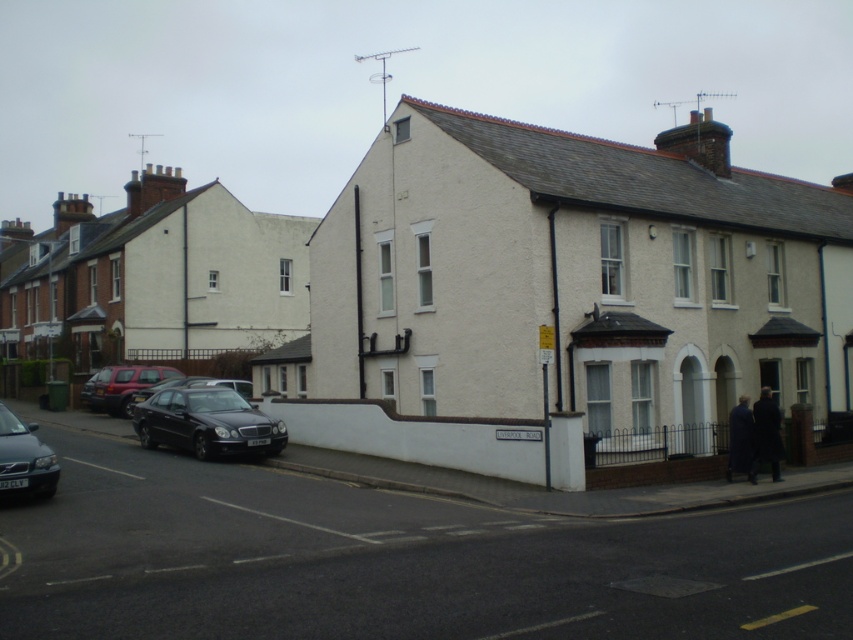
Does matte black car at lower left have a greater height compared to shiny black sedan at center-left?

Yes.

Is matte black car at lower left bigger than shiny black sedan at center-left?

Indeed, matte black car at lower left has a larger size compared to shiny black sedan at center-left.

Which is in front, point (45, 468) or point (183, 380)?

Point (45, 468) is more forward.

Find the location of `matte black car at lower left`. matte black car at lower left is located at coordinates (24, 458).

Does shiny black sedan at lower left have a lesser height compared to matte red car at lower left?

Yes, shiny black sedan at lower left is shorter than matte red car at lower left.

Does point (166, 403) lie behind point (120, 396)?

That is False.

Where is `shiny black sedan at lower left`? The image size is (853, 640). shiny black sedan at lower left is located at coordinates (207, 422).

Which is more to the right, shiny black sedan at lower left or matte black car at lower left?

Positioned to the right is shiny black sedan at lower left.

Does shiny black sedan at lower left appear under matte black car at lower left?

Actually, shiny black sedan at lower left is above matte black car at lower left.

Where is `shiny black sedan at lower left`? The width and height of the screenshot is (853, 640). shiny black sedan at lower left is located at coordinates (207, 422).